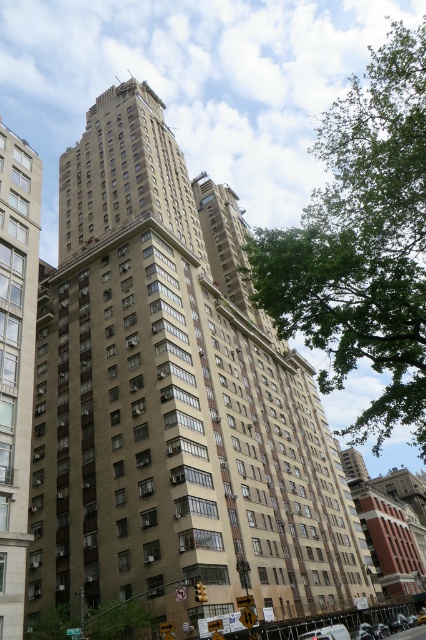
Question: Which is nearer to the beige concrete building at left?

Choices:
 (A) brown brick building at center
 (B) green leafy tree at upper right

Answer: (A)

Question: Does brown brick building at center appear on the right side of green leafy tree at upper right?

Choices:
 (A) no
 (B) yes

Answer: (A)

Question: Is brown brick building at center positioned in front of beige concrete building at left?

Choices:
 (A) no
 (B) yes

Answer: (A)

Question: Does brown brick building at center appear under beige concrete building at left?

Choices:
 (A) no
 (B) yes

Answer: (A)

Question: Which is nearer to the brown brick building at center?

Choices:
 (A) green leafy tree at upper right
 (B) beige concrete building at left

Answer: (A)

Question: Which point is farther to the camera?

Choices:
 (A) beige concrete building at left
 (B) brown brick building at center
 (C) green leafy tree at upper right

Answer: (B)